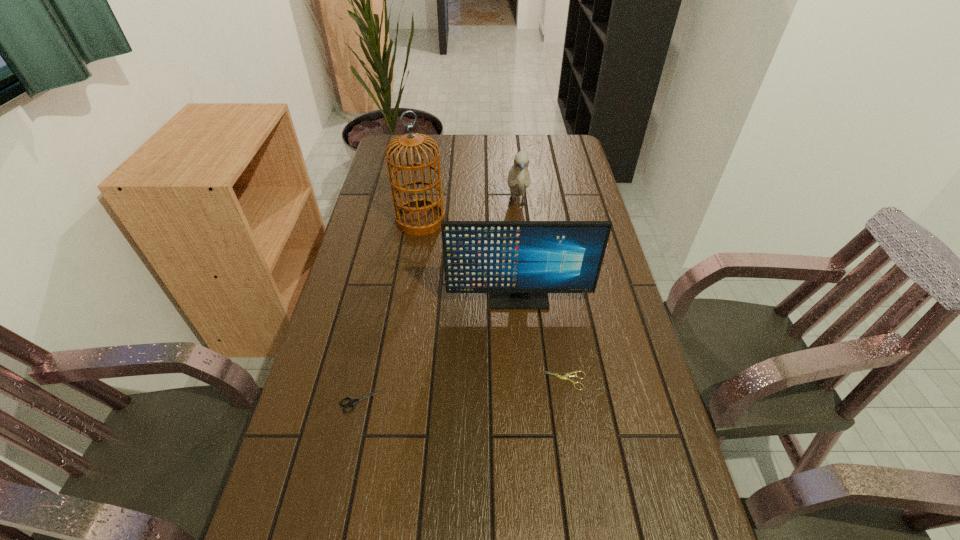
Locate an element on the screen. Image resolution: width=960 pixels, height=540 pixels. vacant space situated at the beak of the third shortest object is located at coordinates (519, 233).

In order to click on vacant area situated on the front of the second shortest object in this screenshot , I will do `click(355, 435)`.

The height and width of the screenshot is (540, 960). Find the location of `vacant position located 0.250m on the front of the shorter shears`. vacant position located 0.250m on the front of the shorter shears is located at coordinates (585, 507).

This screenshot has width=960, height=540. Find the location of `birdcage at the left edge`. birdcage at the left edge is located at coordinates (421, 216).

This screenshot has height=540, width=960. What are the coordinates of `shears that is at the left edge` in the screenshot? It's located at (352, 402).

Identify the location of computer monitor situated at the right edge. The image size is (960, 540). (518, 262).

Identify the location of shears that is at the right edge. (564, 377).

The image size is (960, 540). Find the location of `vacant space at the far edge`. vacant space at the far edge is located at coordinates (538, 150).

The image size is (960, 540). I want to click on free location at the left edge, so click(x=377, y=172).

Locate an element on the screen. free space at the right edge is located at coordinates (557, 188).